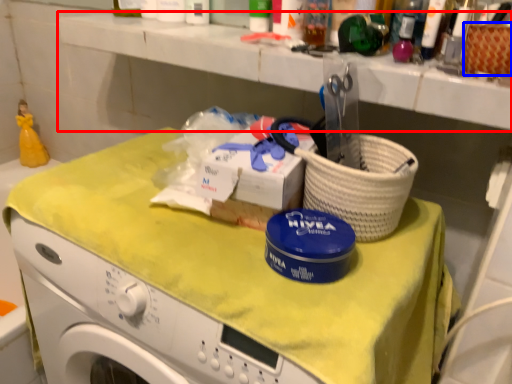
Question: Which object appears closest to the camera in this image, counter top (highlighted by a red box) or basket (highlighted by a blue box)?

Choices:
 (A) counter top
 (B) basket

Answer: (B)